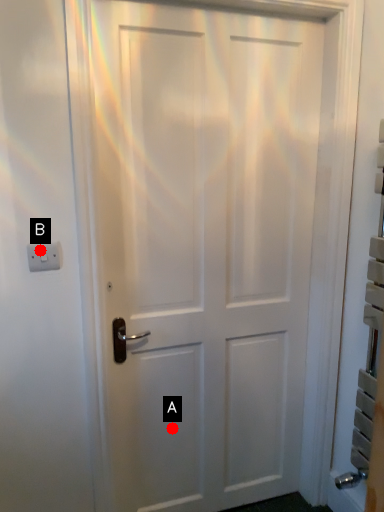
Question: Two points are circled on the image, labeled by A and B beside each circle. Among these points, which one is nearest to the camera?

Choices:
 (A) A is closer
 (B) B is closer

Answer: (B)